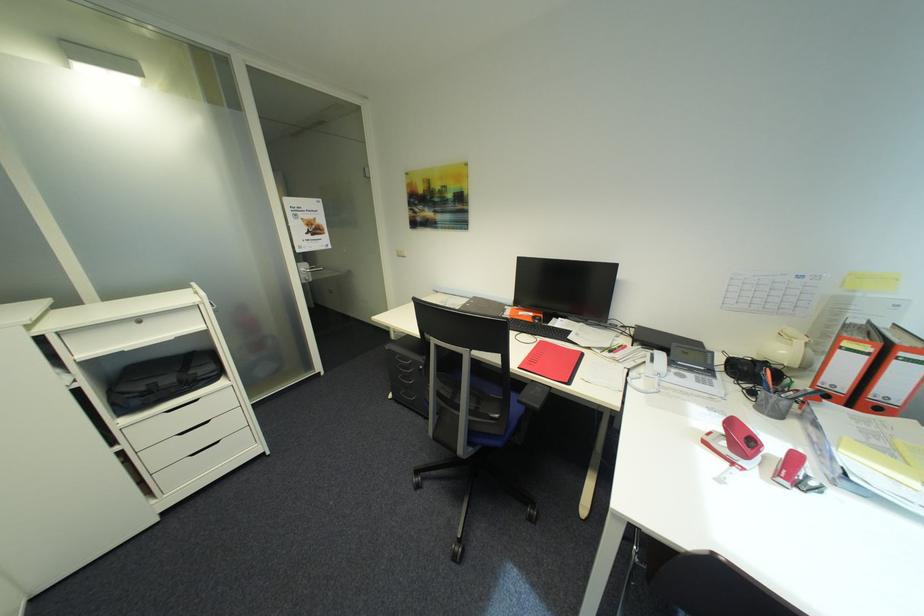
Locate an element on the screen. The height and width of the screenshot is (616, 924). telephone handset is located at coordinates (735, 444).